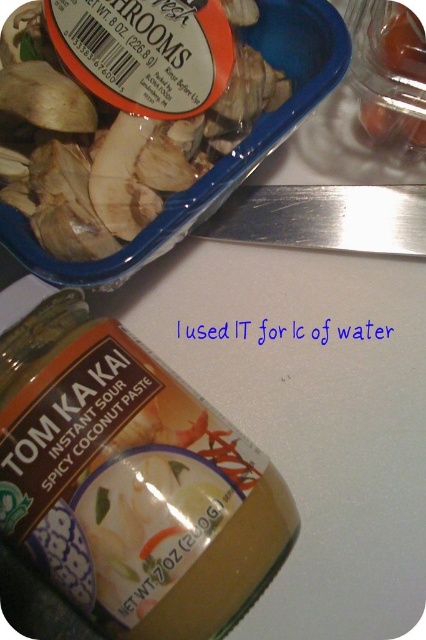
Can you confirm if white sliced mushrooms at upper left is positioned below translucent plastic container at upper right?

Yes.

Does white sliced mushrooms at upper left come behind translucent plastic container at upper right?

No, it is in front of translucent plastic container at upper right.

This screenshot has height=640, width=426. What do you see at coordinates (108, 145) in the screenshot?
I see `white sliced mushrooms at upper left` at bounding box center [108, 145].

At what (x,y) coordinates should I click in order to perform the action: click on white sliced mushrooms at upper left. Please return your answer as a coordinate pair (x, y). Looking at the image, I should click on (108, 145).